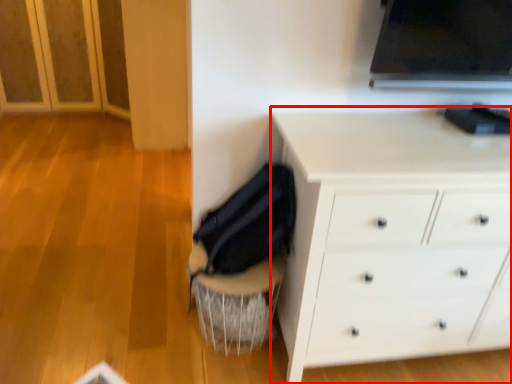
Question: Observing the image, what is the correct spatial positioning of chest of drawers (annotated by the red box) in reference to swivel chair?

Choices:
 (A) left
 (B) right

Answer: (B)